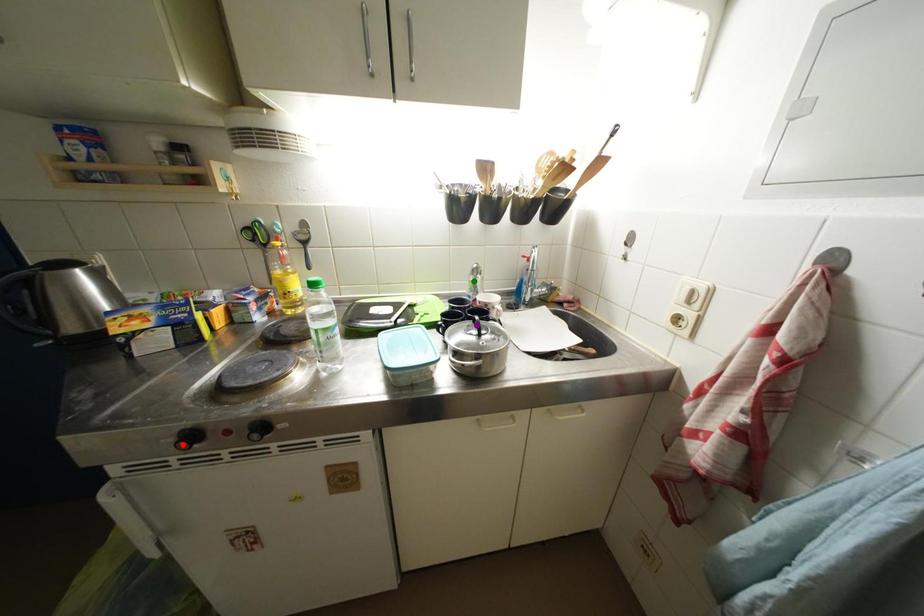
Order these from nearest to farthest:
green point | purple point | red point

1. green point
2. purple point
3. red point